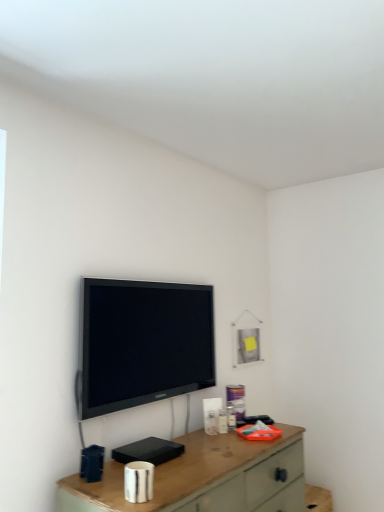
At what (x,y) coordinates should I click in order to perform the action: click on empty space that is ontop of wooden desk at center (from a real-world perspective). Please return your answer as a coordinate pair (x, y). Image resolution: width=384 pixels, height=512 pixels. Looking at the image, I should click on (208, 448).